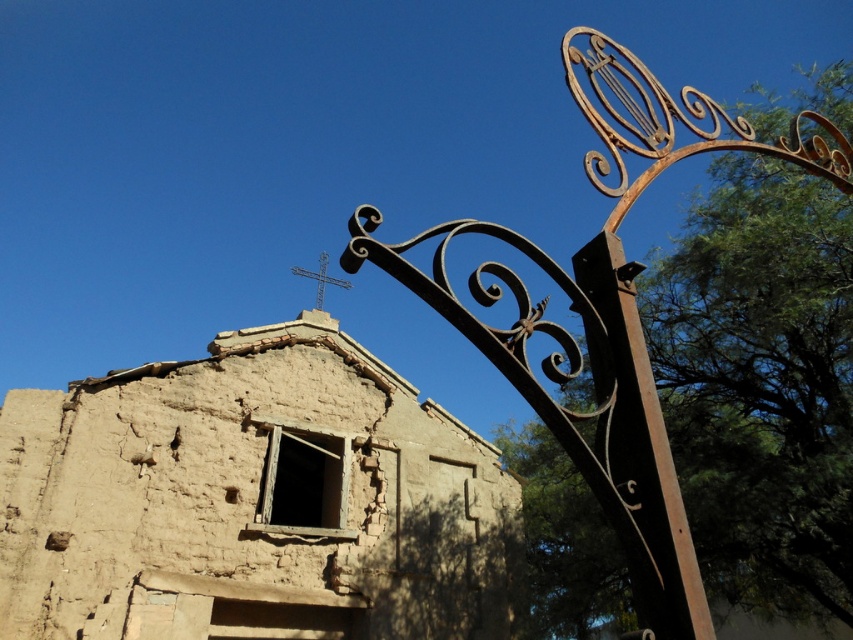
Which is above, rusty metal gate at upper right or rusty metal pole at right?

rusty metal gate at upper right

Between point (494, 333) and point (694, 616), which one is positioned behind?

Point (494, 333)

This screenshot has width=853, height=640. Identify the location of rusty metal gate at upper right. (608, 314).